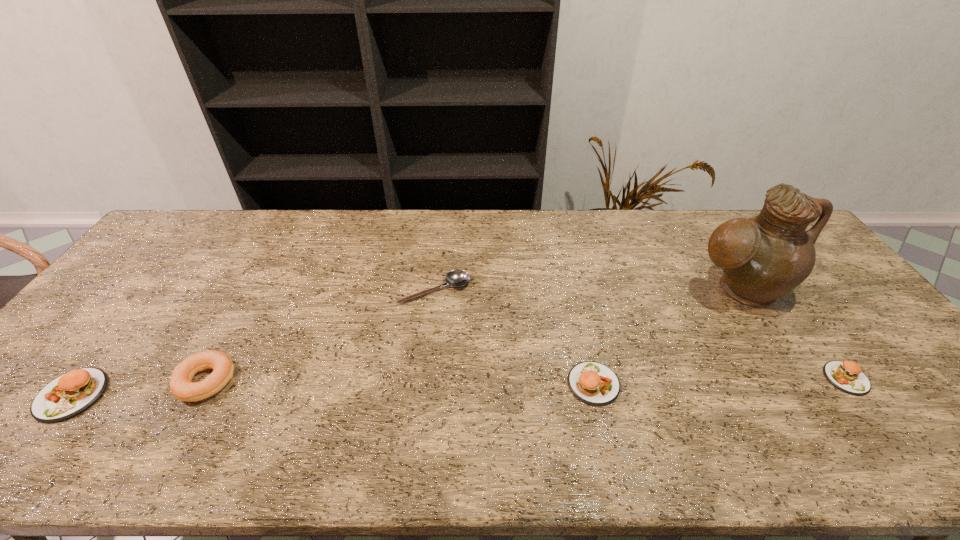
Where is `unoccupied area between the leftmost patty and the fourth object from left to right`? unoccupied area between the leftmost patty and the fourth object from left to right is located at coordinates (333, 389).

Find the location of a particular element. The height and width of the screenshot is (540, 960). free area in between the second tallest patty and the tallest patty is located at coordinates (333, 389).

At what (x,y) coordinates should I click in order to perform the action: click on free space between the leftmost patty and the pitcher. Please return your answer as a coordinate pair (x, y). This screenshot has width=960, height=540. Looking at the image, I should click on (405, 342).

Locate an element on the screen. unoccupied position between the second patty from right to left and the shortest patty is located at coordinates (720, 381).

Locate an element on the screen. object identified as the second closest to the tallest object is located at coordinates (591, 382).

Identify which object is the second closest to the second shortest patty. Please provide its 2D coordinates. Your answer should be formatted as a tuple, i.e. [(x, y)], where the tuple contains the x and y coordinates of a point satisfying the conditions above.

[(764, 257)]

Identify the location of patty that stands as the closest to the ladle. (591, 382).

Identify which patty is the closest to the shortest patty. Please provide its 2D coordinates. Your answer should be formatted as a tuple, i.e. [(x, y)], where the tuple contains the x and y coordinates of a point satisfying the conditions above.

[(591, 382)]

Where is `blank area in the image that satisfies the following two spatial constraints: 1. on the front side of the fourth object from left to right; 2. on the left side of the fifth object from right to left`? The width and height of the screenshot is (960, 540). blank area in the image that satisfies the following two spatial constraints: 1. on the front side of the fourth object from left to right; 2. on the left side of the fifth object from right to left is located at coordinates (204, 384).